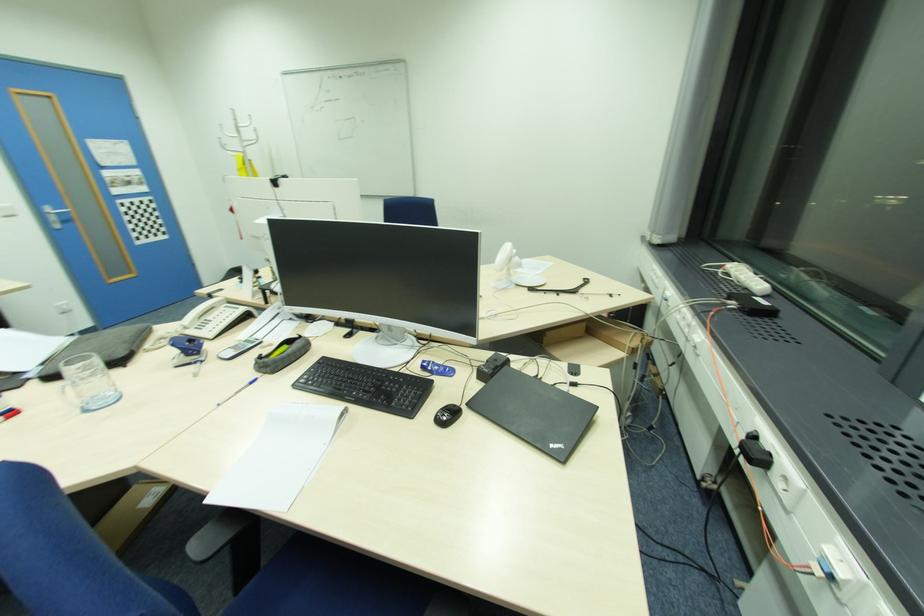
Identify the location of white coat hook. This screenshot has width=924, height=616. (247, 122).